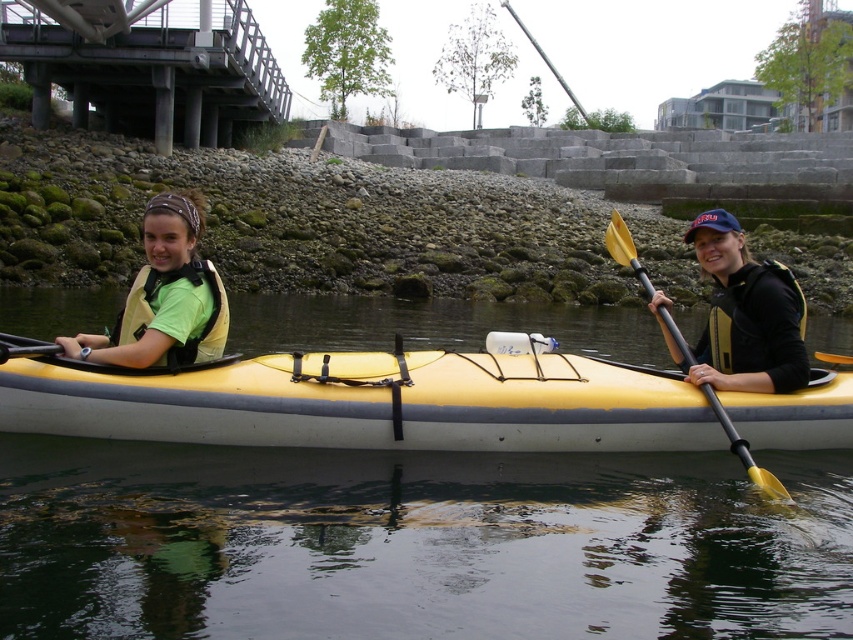
Question: Which object appears closest to the camera in this image?

Choices:
 (A) yellow rubber canoe at center
 (B) yellow plastic paddle at right

Answer: (A)

Question: From the image, what is the correct spatial relationship of yellow rubber canoe at center in relation to matte yellow life vest at left?

Choices:
 (A) above
 (B) below

Answer: (B)

Question: From the image, what is the correct spatial relationship of matte yellow life vest at left in relation to matte yellow life jacket at left?

Choices:
 (A) left
 (B) right

Answer: (B)

Question: Which is farther from the matte yellow life jacket at left?

Choices:
 (A) yellow rubber canoe at center
 (B) yellow rubber kayak at center
 (C) black synthetic life jacket at right

Answer: (B)

Question: Which of the following is the farthest from the observer?

Choices:
 (A) (741, 358)
 (B) (180, 328)

Answer: (A)

Question: Does matte black kayak at right lie in front of yellow plastic paddle at right?

Choices:
 (A) yes
 (B) no

Answer: (B)